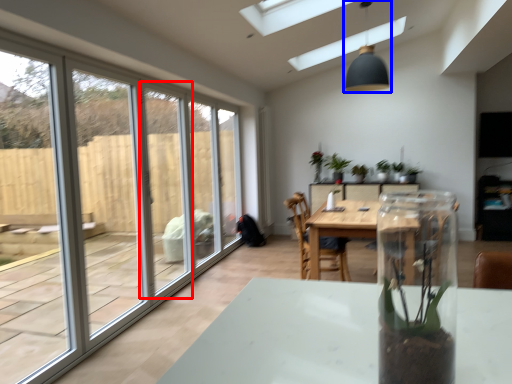
Question: Which of the following is the closest to the observer, screen door (highlighted by a red box) or light fixture (highlighted by a blue box)?

Choices:
 (A) screen door
 (B) light fixture

Answer: (A)